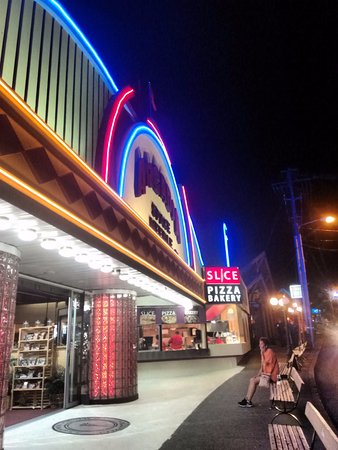
Identify the location of neon light. (104, 164), (123, 178).